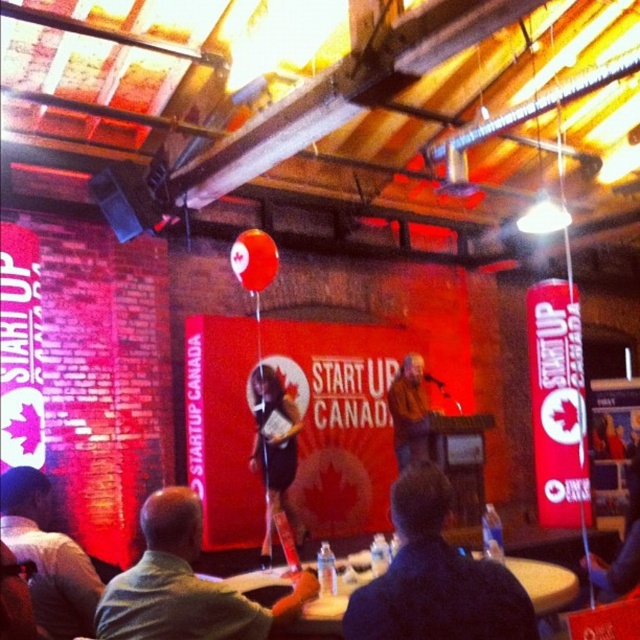
Question: Which point is farther to the camera?

Choices:
 (A) dark blue shirt at center
 (B) matte red balloon at center

Answer: (B)

Question: Where is dark blue shirt at center located in relation to green fabric shirt at center in the image?

Choices:
 (A) left
 (B) right

Answer: (B)

Question: Is dark blue shirt at center to the left of black leather dress at center from the viewer's perspective?

Choices:
 (A) no
 (B) yes

Answer: (A)

Question: Among these objects, which one is nearest to the camera?

Choices:
 (A) smooth wooden table at center
 (B) black leather dress at center

Answer: (A)

Question: Is light brown leather jacket at lower left bigger than smooth wooden table at center?

Choices:
 (A) yes
 (B) no

Answer: (A)

Question: Which of the following is the farthest from the observer?

Choices:
 (A) brown leather jacket at center
 (B) smooth wooden table at center
 (C) black leather dress at center

Answer: (A)